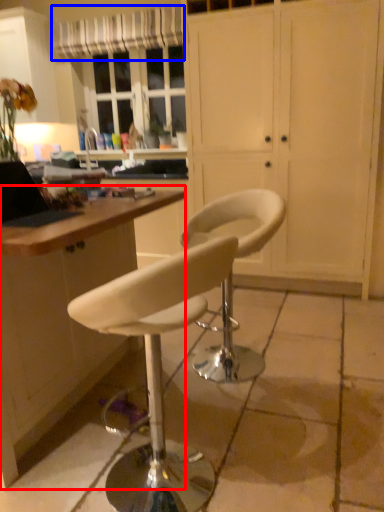
Question: Among these objects, which one is farthest to the camera, desk (highlighted by a red box) or curtain (highlighted by a blue box)?

Choices:
 (A) desk
 (B) curtain

Answer: (B)